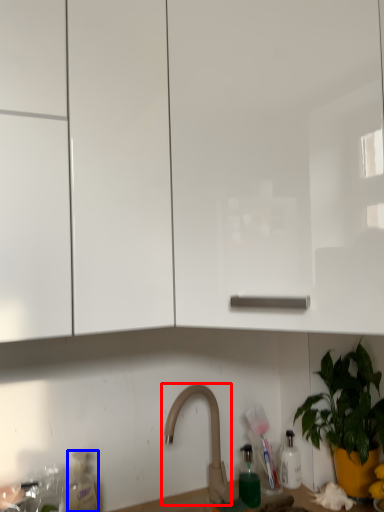
Question: Which of the following is the closest to the observer, tap (highlighted by a red box) or bottle (highlighted by a blue box)?

Choices:
 (A) tap
 (B) bottle

Answer: (A)